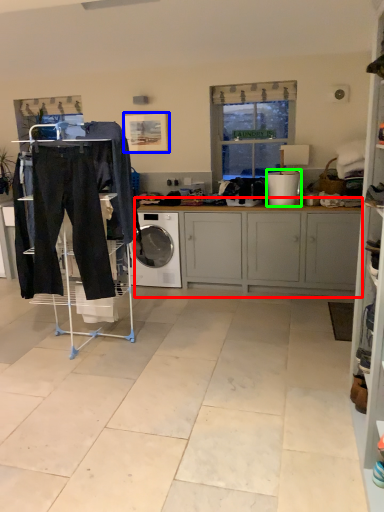
Question: Which is farther away from cabinetry (highlighted by a red box)? picture frame (highlighted by a blue box) or appliance (highlighted by a green box)?

Choices:
 (A) picture frame
 (B) appliance

Answer: (A)